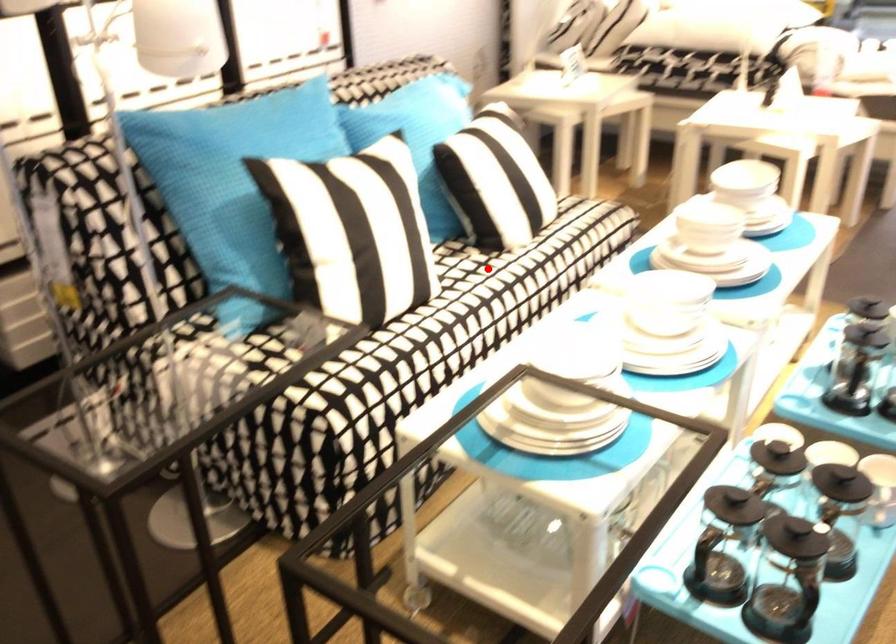
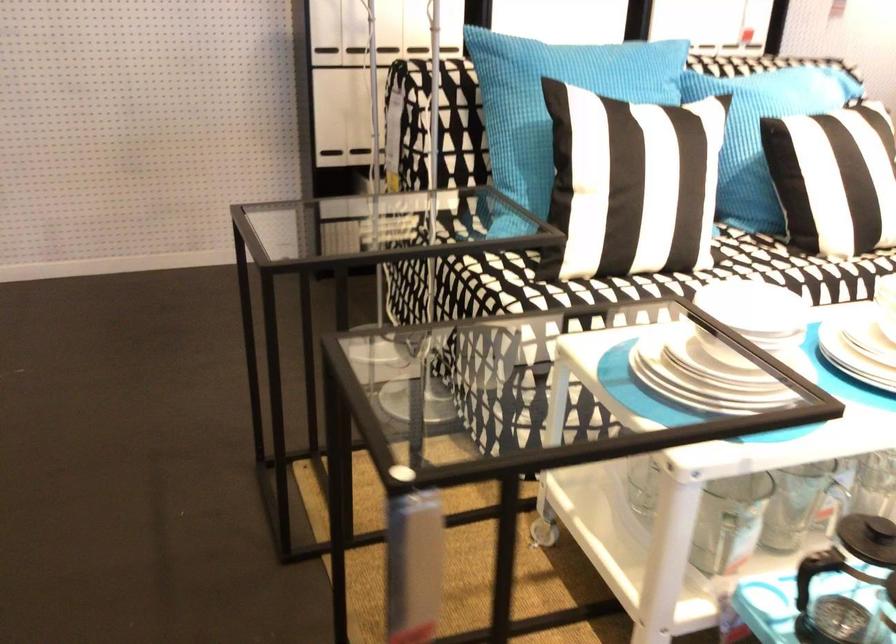
Question: A red point is marked in image1. In image2, is the corresponding 3D point closer to the camera or farther? Reply with the corresponding letter.

Choices:
 (A) The corresponding 3D point is closer.
 (B) The corresponding 3D point is farther.

Answer: (A)